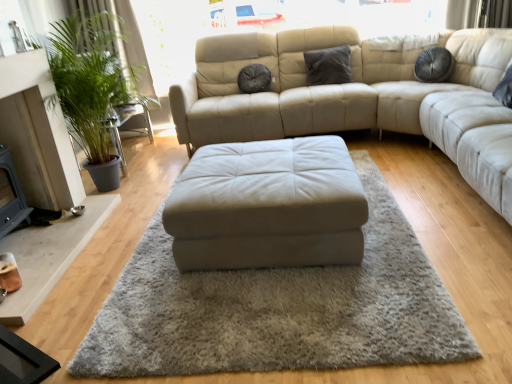
Question: Is beige leather ottoman at center positioned behind green leafy plant at left?

Choices:
 (A) yes
 (B) no

Answer: (B)

Question: Does beige leather ottoman at center have a smaller size compared to green leafy plant at left?

Choices:
 (A) no
 (B) yes

Answer: (B)

Question: Is beige leather ottoman at center positioned beyond the bounds of green leafy plant at left?

Choices:
 (A) yes
 (B) no

Answer: (A)

Question: From the image's perspective, does beige leather ottoman at center appear higher than green leafy plant at left?

Choices:
 (A) no
 (B) yes

Answer: (A)

Question: Considering the relative sizes of beige leather ottoman at center and green leafy plant at left in the image provided, is beige leather ottoman at center taller than green leafy plant at left?

Choices:
 (A) yes
 (B) no

Answer: (B)

Question: Does beige leather ottoman at center have a lesser width compared to green leafy plant at left?

Choices:
 (A) no
 (B) yes

Answer: (A)

Question: Is green leafy plant at left not near dark gray fabric pillow at center, the 2th pillow viewed from the left?

Choices:
 (A) yes
 (B) no

Answer: (A)

Question: Does green leafy plant at left appear on the right side of dark gray fabric pillow at center, the 2th pillow viewed from the left?

Choices:
 (A) yes
 (B) no

Answer: (B)

Question: From a real-world perspective, does green leafy plant at left stand above dark gray fabric pillow at center, the 1th pillow in the right-to-left sequence?

Choices:
 (A) no
 (B) yes

Answer: (A)

Question: From the image's perspective, does green leafy plant at left appear lower than dark gray fabric pillow at center, the 1th pillow in the right-to-left sequence?

Choices:
 (A) yes
 (B) no

Answer: (A)

Question: Is dark gray fabric pillow at center, the 1th pillow in the right-to-left sequence, completely or partially inside green leafy plant at left?

Choices:
 (A) yes
 (B) no

Answer: (B)

Question: Is green leafy plant at left positioned beyond the bounds of dark gray fabric pillow at center, the 2th pillow viewed from the left?

Choices:
 (A) no
 (B) yes

Answer: (B)

Question: Is suede-like gray pillow at center, which appears as the 1th pillow when viewed from the left, facing away from beige leather ottoman at center?

Choices:
 (A) yes
 (B) no

Answer: (B)